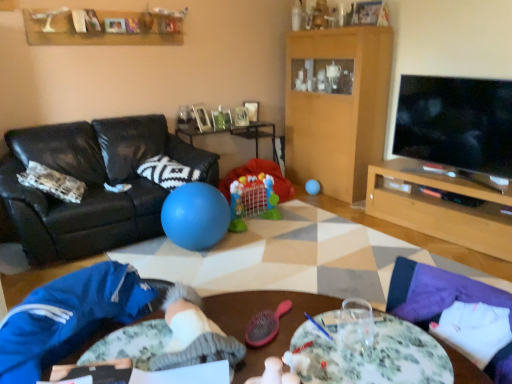
Question: In terms of width, does white knitted pillow at center look wider or thinner when compared to wooden picture frame at upper center, which is the first picture frame from back to front?

Choices:
 (A) thin
 (B) wide

Answer: (B)

Question: In the image, is white knitted pillow at center positioned in front of or behind wooden picture frame at upper center, the second picture frame in the left-to-right sequence?

Choices:
 (A) front
 (B) behind

Answer: (A)

Question: Estimate the real-world distances between objects in this image. Which object is farther from the black leather couch at left?

Choices:
 (A) wooden picture frame at upper center, the first picture frame positioned from the right
 (B) matte blue ball at center, which ranks as the first ball in right-to-left order
 (C) white knitted pillow at center
 (D) floral fabric table at lower right
 (E) blue rubber ball at center, positioned as the second ball in right-to-left order

Answer: (D)

Question: Considering the real-world distances, which object is closest to the wooden tv stand at right, which is the second table in back-to-front order?

Choices:
 (A) flat screen tv at right
 (B) floral-patterned glass at center
 (C) white knitted pillow at center
 (D) blue rubber ball at center, positioned as the second ball in right-to-left order
 (E) smooth plastic ball at center, the 2th table viewed from the right

Answer: (A)